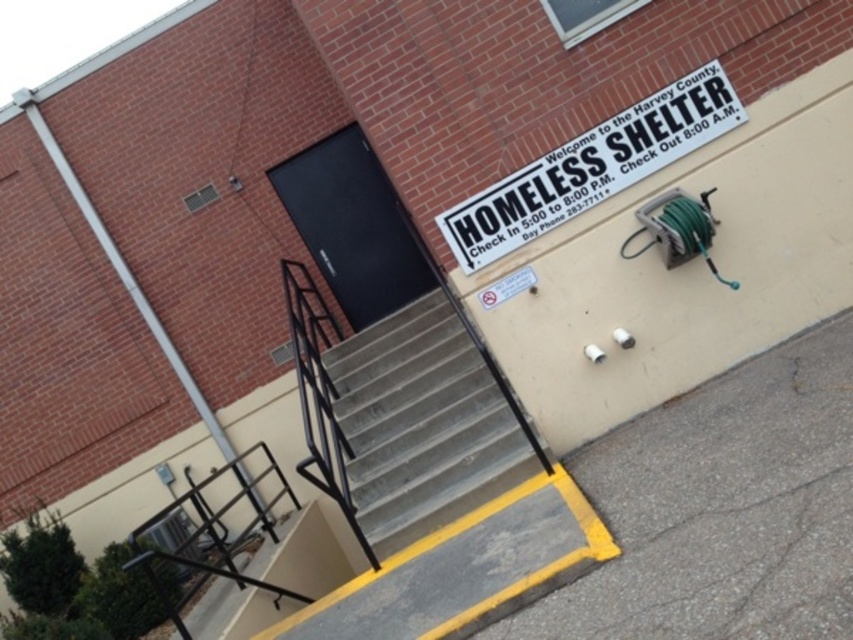
Between white plastic sign at upper center and black metal/rail at lower left, which one is positioned higher?

white plastic sign at upper center

Between point (521, 237) and point (244, 545), which one is positioned behind?

The point (244, 545) is more distant.

In order to click on white plastic sign at upper center in this screenshot , I will do `click(590, 168)`.

From the picture: Who is shorter, concrete stairs at center or white plastic sign at upper center?

white plastic sign at upper center

Does concrete stairs at center have a larger size compared to white plastic sign at upper center?

Yes.

This screenshot has width=853, height=640. Identify the location of concrete stairs at center. (410, 426).

Can you confirm if concrete stairs at center is smaller than black metal/rail at lower left?

No.

How distant is concrete stairs at center from black metal/rail at lower left?

concrete stairs at center and black metal/rail at lower left are 3.84 feet apart.

Is point (463, 486) less distant than point (195, 493)?

That is True.

At what (x,y) coordinates should I click in order to perform the action: click on concrete stairs at center. Please return your answer as a coordinate pair (x, y). The image size is (853, 640). Looking at the image, I should click on (410, 426).